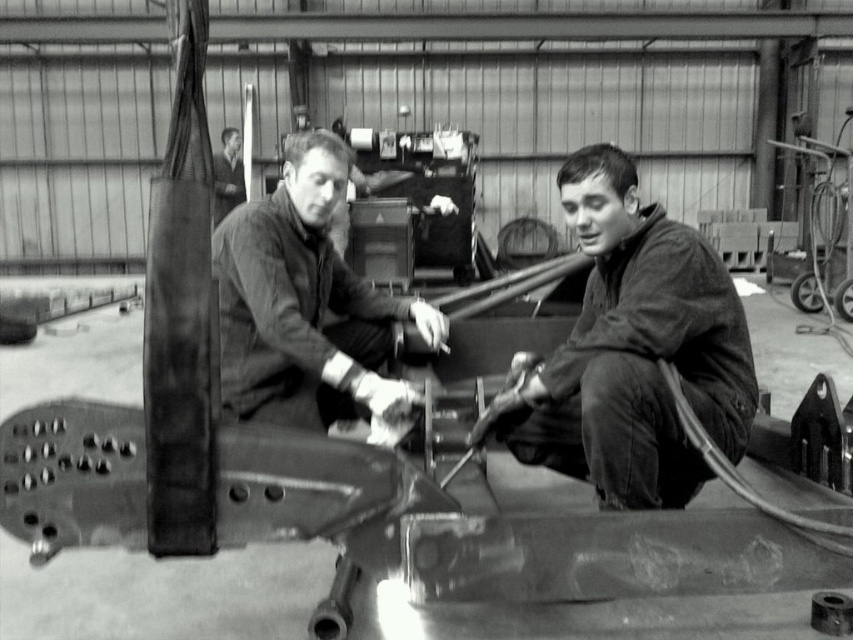
You are an inspector in this workshop and need to locate the matte black jacket at lower right and the matte black jacket at center. Which one is positioned further to the right?

The matte black jacket at lower right is to the right of matte black jacket at center, so it is positioned further to the right.

You are an inspector in this workshop and need to locate both the matte black jacket at center and the smooth leather jacket at upper left. Based on their positions, which jacket is closer to the right edge of the image?

The matte black jacket at center is closer to the right edge of the image because it is positioned to the right of the smooth leather jacket at upper left.

Looking at this image, you are a delivery person who needs to place a box between the matte black jacket at center and the smooth leather jacket at upper left. The box requires a minimum of 20 feet of space. Can you fit the box between them?

The matte black jacket at center and smooth leather jacket at upper left are 19.54 feet apart from each other. Since the required space is 20 feet, the box cannot be placed between them as there is insufficient space.